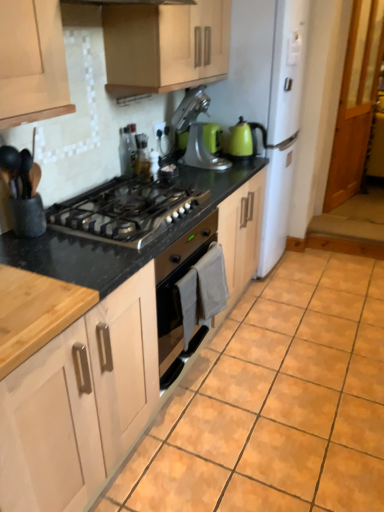
Question: In the image, is satin silver toaster at upper center, the 2th appliance from the front, on the left side or the right side of stainless steel gas stove at center?

Choices:
 (A) right
 (B) left

Answer: (B)

Question: From the image's perspective, is satin silver toaster at upper center, placed as the 1th appliance when sorted from left to right, located above or below stainless steel gas stove at center?

Choices:
 (A) above
 (B) below

Answer: (A)

Question: Estimate the real-world distances between objects in this image. Which object is closer to the orange matte tile at center?

Choices:
 (A) stainless steel gas stove at center
 (B) natural wood countertop at lower left
 (C) metallic silver stand mixer at upper center
 (D) matte wood cabinet at upper center, the second cabinetry in the bottom-to-top sequence
 (E) translucent glass bottle at upper center, the second appliance positioned from the right

Answer: (A)

Question: Which object is the closest to the matte wood cabinet at upper center, the second cabinetry in the bottom-to-top sequence?

Choices:
 (A) orange matte tile at center
 (B) translucent glass bottle at upper center, the second appliance positioned from the right
 (C) natural wood cabinet doors at lower left, which is counted as the 2th cabinetry, starting from the top
 (D) metallic silver stand mixer at upper center
 (E) green matte stand mixer at center, the 1th appliance from the back

Answer: (D)